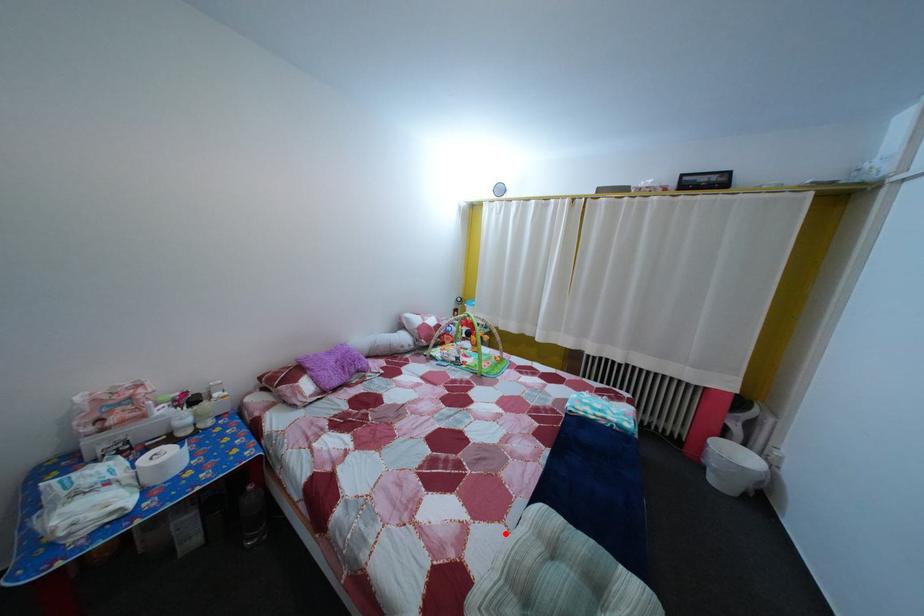
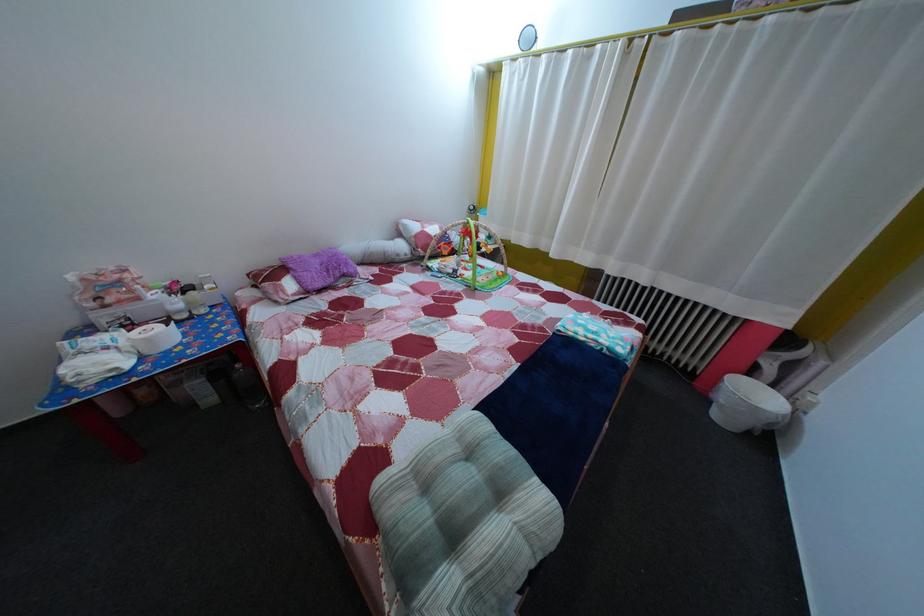
Where in the second image is the point corresponding to the highlighted location from the first image?

(442, 432)